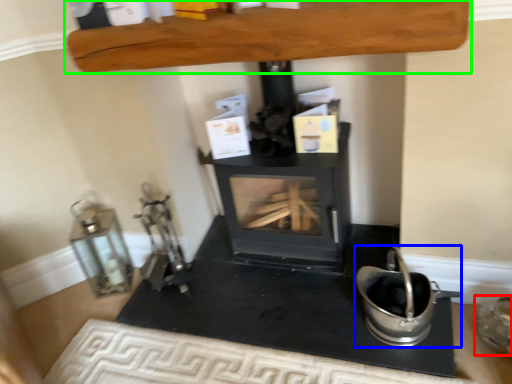
Question: Which is nearer to the appliance (highlighted by a red box)? appliance (highlighted by a blue box) or furniture (highlighted by a green box).

Choices:
 (A) appliance
 (B) furniture

Answer: (A)